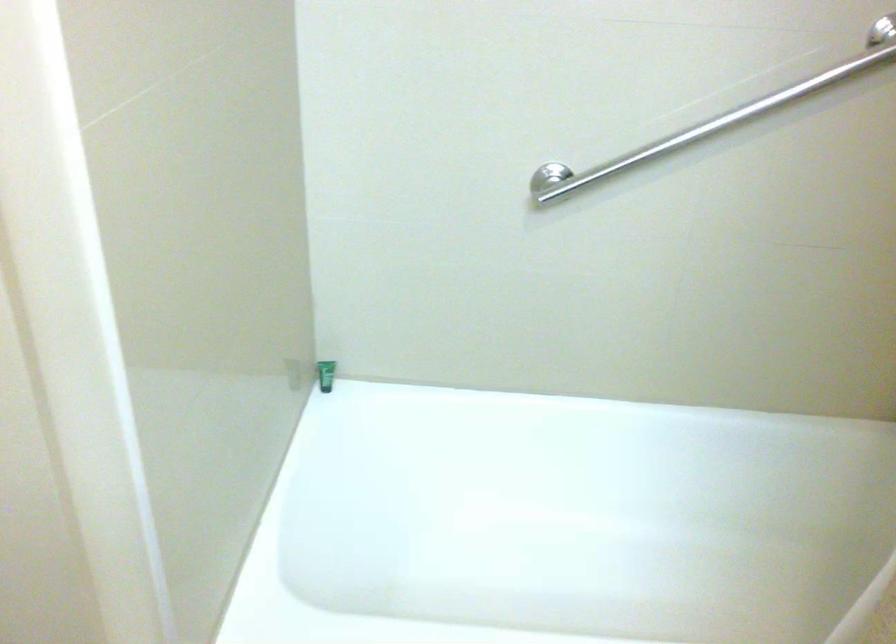
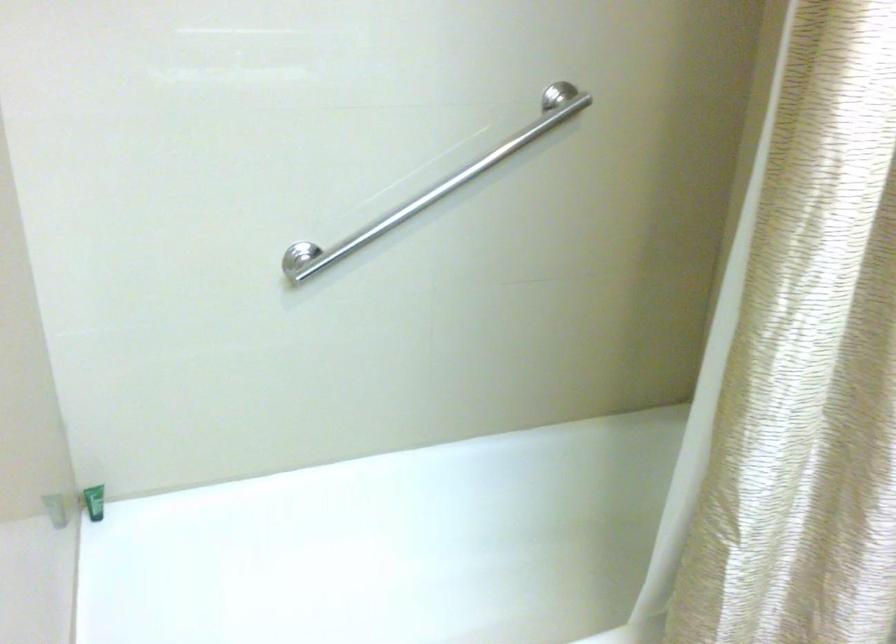
Question: The camera is either moving clockwise (left) or counter-clockwise (right) around the object. The first image is from the beginning of the video and the second image is from the end. Is the camera moving left or right when shooting the video?

Choices:
 (A) Left
 (B) Right

Answer: (A)